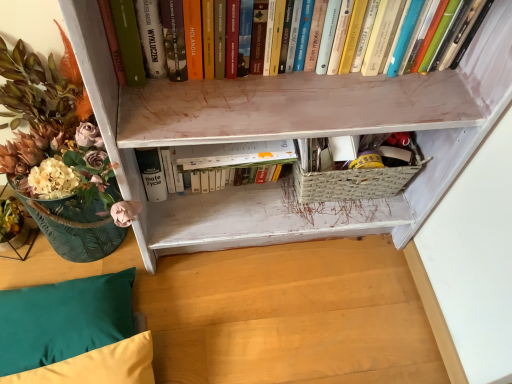
Question: Considering the positions of hardcover books at upper center, which is the second book from back to front, and woven straw basket at lower center in the image, is hardcover books at upper center, which is the second book from back to front, bigger or smaller than woven straw basket at lower center?

Choices:
 (A) big
 (B) small

Answer: (A)

Question: Is hardcover books at upper center, the 1th book viewed from the top, in front of or behind woven straw basket at lower center in the image?

Choices:
 (A) behind
 (B) front

Answer: (B)

Question: Estimate the real-world distances between objects in this image. Which object is closer to the velvet yellow pillow at lower left, placed as the 2th pillow when sorted from top to bottom?

Choices:
 (A) white matte book at center, which is the 2th book from top to bottom
 (B) teal fabric pillow at lower left, placed as the 2th pillow when sorted from bottom to top
 (C) translucent glass vase at left
 (D) hardcover books at upper center, placed as the 1th book when sorted from front to back
 (E) woven straw basket at lower center

Answer: (B)

Question: Which is nearer to the white matte book at center, which ranks as the 2th book in front-to-back order?

Choices:
 (A) translucent glass vase at left
 (B) teal fabric pillow at lower left, placed as the 2th pillow when sorted from bottom to top
 (C) velvet yellow pillow at lower left, placed as the first pillow when sorted from bottom to top
 (D) hardcover books at upper center, placed as the 1th book when sorted from front to back
 (E) woven straw basket at lower center

Answer: (E)